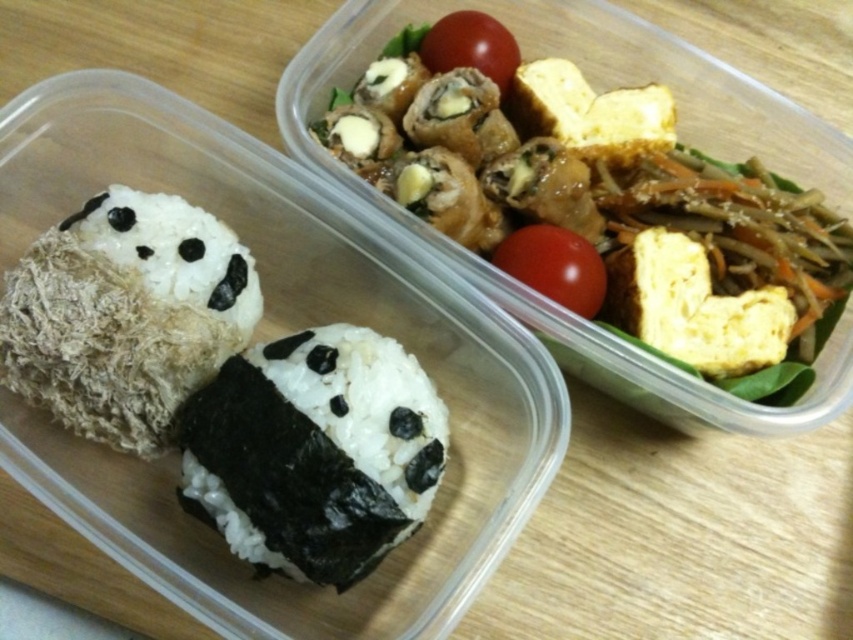
Question: Which of the following is the closest to the observer?

Choices:
 (A) red matte tomato at center
 (B) smooth tofu at upper center
 (C) black nori rice ball at center
 (D) red matte tomato at upper center

Answer: (C)

Question: Which point is closer to the camera taking this photo?

Choices:
 (A) (424, 51)
 (B) (592, 253)
 (C) (392, 419)
 (D) (647, 349)

Answer: (C)

Question: Which point is farther from the camera taking this photo?

Choices:
 (A) (576, 269)
 (B) (483, 230)
 (C) (283, 417)

Answer: (B)

Question: Does smooth tofu at upper center come in front of red matte tomato at upper center?

Choices:
 (A) no
 (B) yes

Answer: (B)

Question: Is smooth tofu at upper center to the left of red matte tomato at center from the viewer's perspective?

Choices:
 (A) yes
 (B) no

Answer: (B)

Question: Is black nori rice ball at center closer to camera compared to red matte tomato at upper center?

Choices:
 (A) no
 (B) yes

Answer: (B)